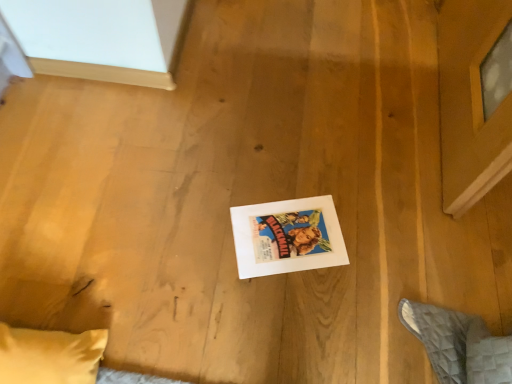
This screenshot has width=512, height=384. What are the coordinates of `free point above white paper at center (from a real-world perspective)` in the screenshot? It's located at (290, 237).